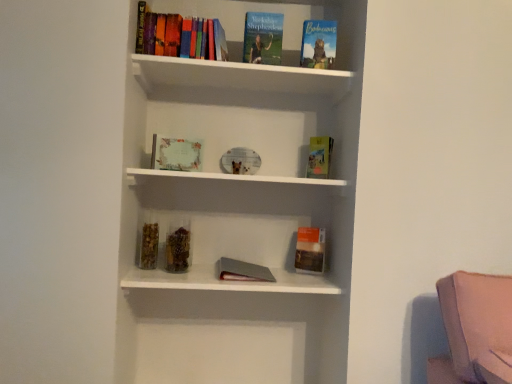
Question: In terms of width, does hardcover book at center, marked as the first paperback book in a top-to-bottom arrangement, look wider or thinner when compared to hardcover book at upper right, positioned as the 4th book in left-to-right order?

Choices:
 (A) wide
 (B) thin

Answer: (B)

Question: From the image's perspective, is hardcover book at center, marked as the first paperback book in a top-to-bottom arrangement, positioned above or below hardcover book at upper right, placed as the 1th book when sorted from right to left?

Choices:
 (A) above
 (B) below

Answer: (B)

Question: Which of these objects is positioned closest to the hardcover book at center, marked as the first paperback book in a top-to-bottom arrangement?

Choices:
 (A) matte paper certificate at center, marked as the 1th book in a left-to-right arrangement
 (B) matte orange paperback book at right, acting as the second paperback book starting from the top
 (C) hardcover book at upper center, the 2th book viewed from the right
 (D) hardcover book at upper center, marked as the 2th book in a left-to-right arrangement
 (E) hardcover book at upper right, positioned as the 4th book in left-to-right order

Answer: (B)

Question: Estimate the real-world distances between objects in this image. Which object is closer to the matte orange paperback book at right, acting as the second paperback book starting from the top?

Choices:
 (A) hardcover book at upper center, the 2th book viewed from the right
 (B) matte paper certificate at center, marked as the 1th book in a left-to-right arrangement
 (C) hardcover book at upper right, positioned as the 4th book in left-to-right order
 (D) hardcover book at upper center, which is the third book from right to left
 (E) hardcover book at center, which ranks as the 2th paperback book in bottom-to-top order

Answer: (E)